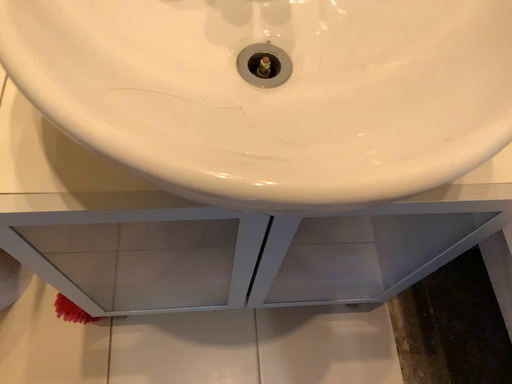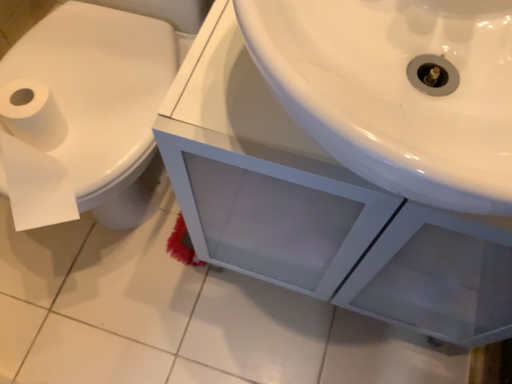
Question: Which way did the camera rotate in the video?

Choices:
 (A) rotated left
 (B) rotated right

Answer: (A)